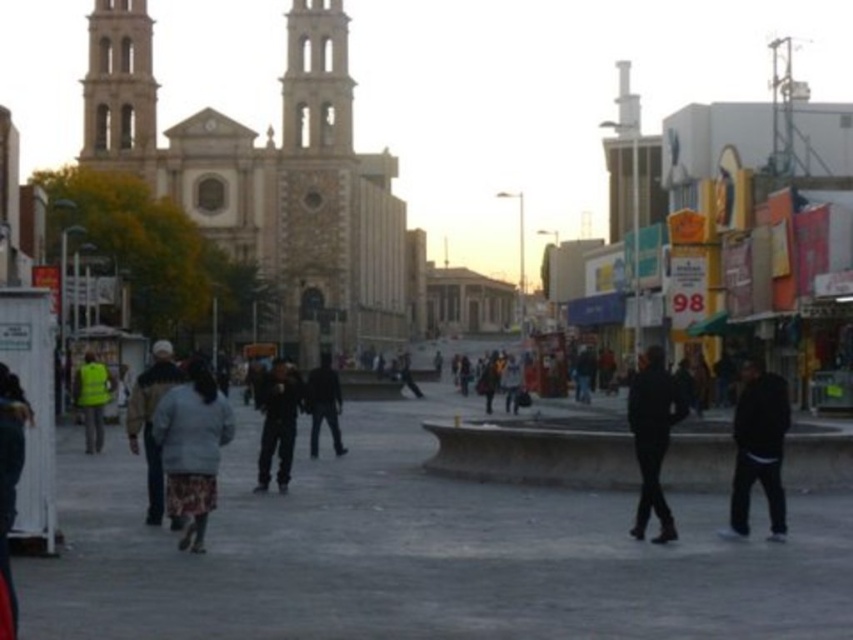
Based on the photo, is light beige stone tower at upper left bigger than dark gray jacket at center?

Incorrect, light beige stone tower at upper left is not larger than dark gray jacket at center.

Is light beige stone tower at upper left above dark gray jacket at center?

Correct, light beige stone tower at upper left is located above dark gray jacket at center.

Describe the element at coordinates (119, 90) in the screenshot. I see `light beige stone tower at upper left` at that location.

Where is `light beige stone tower at upper left`? light beige stone tower at upper left is located at coordinates (119, 90).

Is dark gray jacket at center below dark clothing figure at center?

Yes.

Between dark gray jacket at center and dark clothing figure at center, which one is positioned higher?

dark clothing figure at center is higher up.

Between point (172, 524) and point (322, 400), which one is positioned behind?

Point (322, 400)

This screenshot has width=853, height=640. I want to click on dark gray jacket at center, so click(x=149, y=420).

Is point (337, 4) closer to camera compared to point (311, 410)?

No, it is not.

Can you confirm if brown stone church at center is positioned below dark clothing figure at center?

No.

Find the location of a particular element. The width and height of the screenshot is (853, 640). brown stone church at center is located at coordinates (271, 179).

Locate an element on the screen. The image size is (853, 640). brown stone church at center is located at coordinates (271, 179).